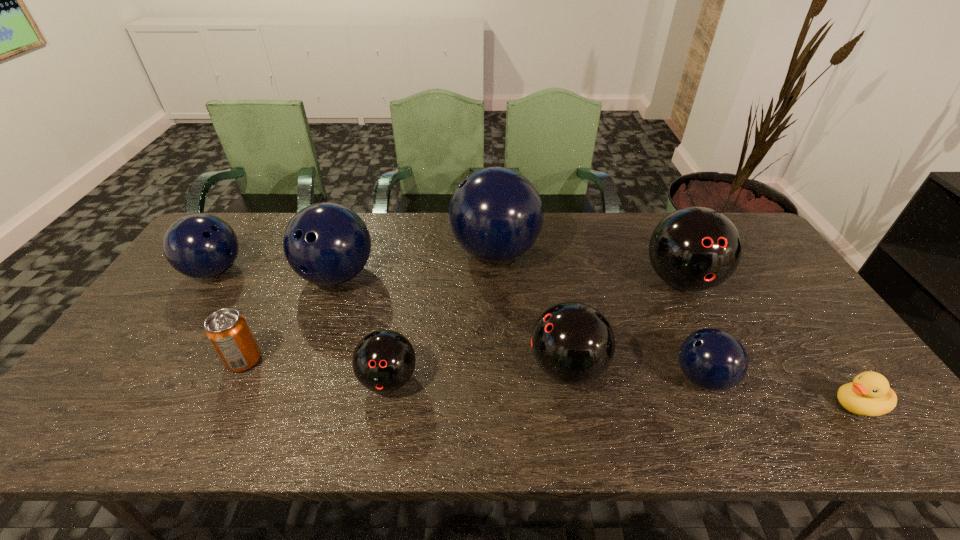
Identify the location of vacant space located 0.380m on the surface of the second biggest blue bowling ball near the finger holes. (283, 426).

I want to click on free location located on the surface of the leftmost blue bowling ball near the finger holes, so click(308, 271).

You are a GUI agent. You are given a task and a screenshot of the screen. Output one action in this format:
    pyautogui.click(x=<x>, y=<y>)
    Task: Click on the vacant space located 0.130m on the surface of the second black bowling ball from right to left near the finger holes
    This screenshot has width=960, height=540.
    Given the screenshot: What is the action you would take?
    (x=476, y=368)

The image size is (960, 540). In order to click on free space located 0.390m on the surface of the second black bowling ball from right to left near the finger holes in this screenshot , I will do `click(371, 368)`.

Find the location of a particular element. This screenshot has width=960, height=540. vacant space situated 0.190m on the surface of the second black bowling ball from right to left near the finger holes is located at coordinates (452, 368).

Locate an element on the screen. free region located 0.260m on the right of the soda can is located at coordinates (365, 360).

You are a GUI agent. You are given a task and a screenshot of the screen. Output one action in this format:
    pyautogui.click(x=<x>, y=<y>)
    Task: Click on the free region located on the surface of the fourth object from left to right near the finger holes
    The width and height of the screenshot is (960, 540).
    Given the screenshot: What is the action you would take?
    pyautogui.click(x=377, y=443)

The width and height of the screenshot is (960, 540). I want to click on free space located on the surface of the rightmost blue bowling ball near the finger holes, so click(x=652, y=378).

Where is `blank space located 0.220m on the surface of the rightmost blue bowling ball near the finger holes`? blank space located 0.220m on the surface of the rightmost blue bowling ball near the finger holes is located at coordinates (582, 378).

Identify the location of vacant area situated on the surface of the rightmost blue bowling ball near the finger holes. (528, 378).